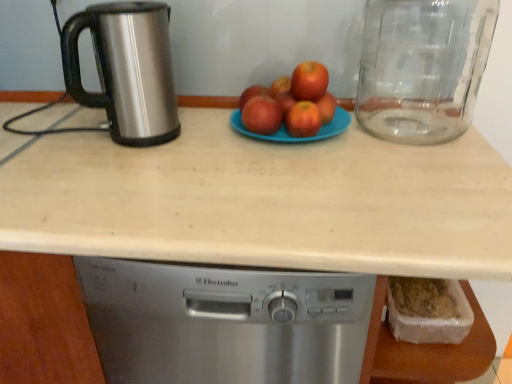
This screenshot has width=512, height=384. I want to click on empty space that is ontop of beige laminate countertop at center (from a real-world perspective), so click(x=182, y=160).